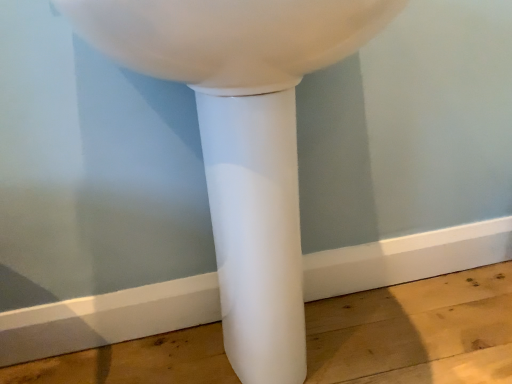
The height and width of the screenshot is (384, 512). I want to click on vacant area that is situated to the right of white glossy toilet at center, so click(x=433, y=321).